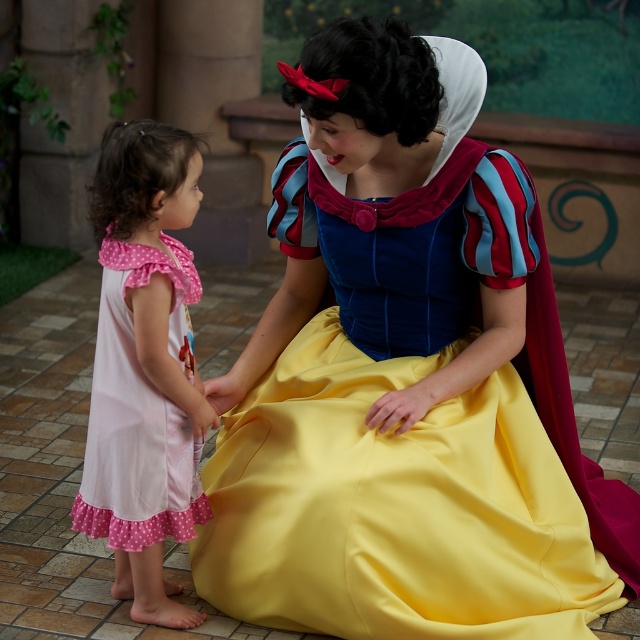
You are a costume designer preparing for a parade. You need to ensure that the two dresses mentioned can fit through a narrow doorway that is 1.2 meters wide. Based on their widths, will both the matte blue dress at center and the pink polka dot fabric dress at left be able to pass through the doorway without any issues?

The matte blue dress at center is wider than the pink polka dot fabric dress at left. Since the doorway is 1.2 meters wide, both dresses can pass through as long as their individual widths are less than 1.2 meters. However, the exact widths are not provided, so we cannot confirm definitively. However, since the matte blue dress is wider, it would require more space. If the narrower pink polka dot fabric dress fits, the wider matte blue dress may also fit if its width is within the 1.2 meters limit.

You are a photographer at a Disney event. You need to position a camera at point A to capture the matte blue dress at center. Where should you place the camera to ensure the dress is in the center of the photo?

Place the camera at point A at coordinates matching the center of the matte blue dress at center, which is at point (406, 378). This will ensure the dress is centered in the photo.